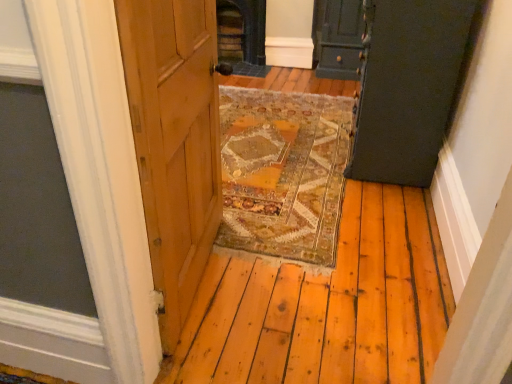
Question: Visually, is dark green wood door at upper right, the 1th door when ordered from back to front, positioned to the left or to the right of dark gray stone fireplace at center?

Choices:
 (A) right
 (B) left

Answer: (A)

Question: In terms of height, does dark green wood door at upper right, the 1th door when ordered from back to front, look taller or shorter compared to dark gray stone fireplace at center?

Choices:
 (A) tall
 (B) short

Answer: (A)

Question: Estimate the real-world distances between objects in this image. Which object is closer to the dark gray stone fireplace at center?

Choices:
 (A) dark green wood door at upper right, the 1th door when ordered from back to front
 (B) matte dark green cabinet at upper right, marked as the second door in a back-to-front arrangement

Answer: (A)

Question: Which is nearer to the dark gray stone fireplace at center?

Choices:
 (A) matte dark green cabinet at upper right, acting as the 1th door starting from the front
 (B) dark green wood door at upper right, acting as the second door starting from the front

Answer: (B)